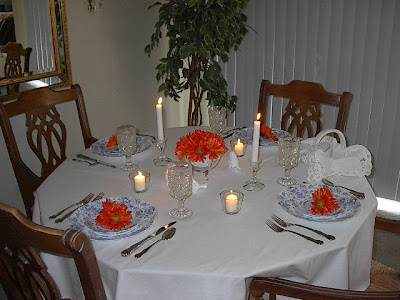
The image size is (400, 300). Find the location of `wooden chairs in the image`. wooden chairs in the image is located at coordinates (36, 241), (43, 104), (15, 48), (299, 96), (298, 288).